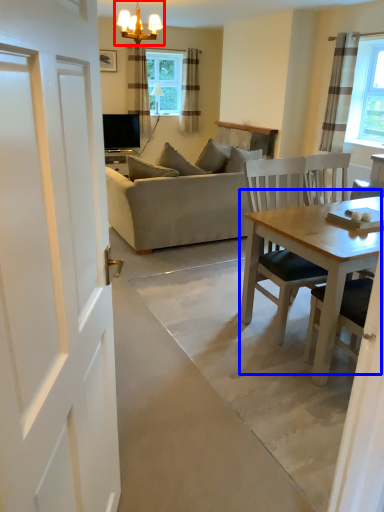
Question: Which of the following is the closest to the observer, light fixture (highlighted by a red box) or table (highlighted by a blue box)?

Choices:
 (A) light fixture
 (B) table

Answer: (B)